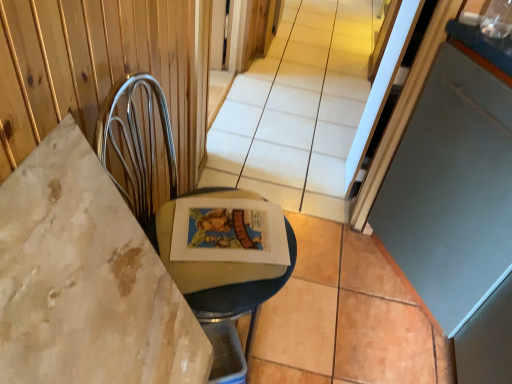
Where is `matte gray screen door at right`? The width and height of the screenshot is (512, 384). matte gray screen door at right is located at coordinates (452, 190).

Image resolution: width=512 pixels, height=384 pixels. What do you see at coordinates (452, 190) in the screenshot?
I see `matte gray screen door at right` at bounding box center [452, 190].

This screenshot has height=384, width=512. What do you see at coordinates (136, 141) in the screenshot?
I see `metallic silver swivel chair at left` at bounding box center [136, 141].

Measure the distance between metallic silver swivel chair at left and camera.

A distance of 27.72 inches exists between metallic silver swivel chair at left and camera.

You are a GUI agent. You are given a task and a screenshot of the screen. Output one action in this format:
    pyautogui.click(x=<x>, y=<y>)
    Task: Click on the metallic silver swivel chair at left
    
    Given the screenshot: What is the action you would take?
    pyautogui.click(x=136, y=141)

Find the location of a particular element. The image size is (512, 384). matte gray screen door at right is located at coordinates (452, 190).

Is metallic silver swivel chair at left to the left of matte gray screen door at right from the viewer's perspective?

Yes.

Is the position of metallic silver swivel chair at left more distant than that of matte gray screen door at right?

No, metallic silver swivel chair at left is closer to the viewer.

Which is behind, point (112, 94) or point (448, 269)?

The point (448, 269) is behind.

From the image's perspective, is metallic silver swivel chair at left above matte gray screen door at right?

No, from the image's perspective, metallic silver swivel chair at left is not over matte gray screen door at right.

From a real-world perspective, which object stands above the other?

From a 3D spatial view, matte gray screen door at right is above.

In terms of width, does metallic silver swivel chair at left look wider or thinner when compared to matte gray screen door at right?

In the image, metallic silver swivel chair at left appears to be more narrow than matte gray screen door at right.

In terms of height, does metallic silver swivel chair at left look taller or shorter compared to matte gray screen door at right?

In the image, metallic silver swivel chair at left appears to be shorter than matte gray screen door at right.

Considering the sizes of metallic silver swivel chair at left and matte gray screen door at right in the image, is metallic silver swivel chair at left bigger or smaller than matte gray screen door at right?

Considering their sizes, metallic silver swivel chair at left takes up less space than matte gray screen door at right.

Do you think metallic silver swivel chair at left is within matte gray screen door at right, or outside of it?

metallic silver swivel chair at left is not enclosed by matte gray screen door at right.

Is metallic silver swivel chair at left not close to matte gray screen door at right?

No.

Consider the image. Could you tell me if metallic silver swivel chair at left is facing matte gray screen door at right?

Yes.

What's the angular difference between metallic silver swivel chair at left and matte gray screen door at right's facing directions?

The facing directions of metallic silver swivel chair at left and matte gray screen door at right are 177 degrees apart.

Measure the distance from metallic silver swivel chair at left to matte gray screen door at right.

metallic silver swivel chair at left is 28.91 inches away from matte gray screen door at right.

Find the location of a particular element. The width and height of the screenshot is (512, 384). screen door located above the metallic silver swivel chair at left (from a real-world perspective) is located at coordinates (452, 190).

Does matte gray screen door at right appear on the left side of metallic silver swivel chair at left?

Incorrect, matte gray screen door at right is not on the left side of metallic silver swivel chair at left.

Is matte gray screen door at right behind metallic silver swivel chair at left?

Yes, it is.

Does point (466, 125) come behind point (210, 309)?

Yes, it is.

From the image's perspective, which is below, matte gray screen door at right or metallic silver swivel chair at left?

From the image's view, metallic silver swivel chair at left is below.

From a real-world perspective, who is located higher, matte gray screen door at right or metallic silver swivel chair at left?

matte gray screen door at right is physically above.

Can you confirm if matte gray screen door at right is thinner than metallic silver swivel chair at left?

No, matte gray screen door at right is not thinner than metallic silver swivel chair at left.

Between matte gray screen door at right and metallic silver swivel chair at left, which one has more height?

matte gray screen door at right.

Considering the relative sizes of matte gray screen door at right and metallic silver swivel chair at left in the image provided, is matte gray screen door at right smaller than metallic silver swivel chair at left?

Actually, matte gray screen door at right might be larger than metallic silver swivel chair at left.

Is matte gray screen door at right inside or outside of metallic silver swivel chair at left?

matte gray screen door at right is outside metallic silver swivel chair at left.

Is matte gray screen door at right not close to metallic silver swivel chair at left?

No, matte gray screen door at right is not far from metallic silver swivel chair at left.

Is matte gray screen door at right looking in the opposite direction of metallic silver swivel chair at left?

No.

Measure the distance from matte gray screen door at right to metallic silver swivel chair at left.

A distance of 28.91 inches exists between matte gray screen door at right and metallic silver swivel chair at left.

The height and width of the screenshot is (384, 512). Find the location of `swivel chair below the matte gray screen door at right (from a real-world perspective)`. swivel chair below the matte gray screen door at right (from a real-world perspective) is located at coordinates (136, 141).

Where is `swivel chair in front of the matte gray screen door at right`? This screenshot has height=384, width=512. swivel chair in front of the matte gray screen door at right is located at coordinates (136, 141).

Where is `swivel chair below the matte gray screen door at right (from a real-world perspective)`? The image size is (512, 384). swivel chair below the matte gray screen door at right (from a real-world perspective) is located at coordinates (136, 141).